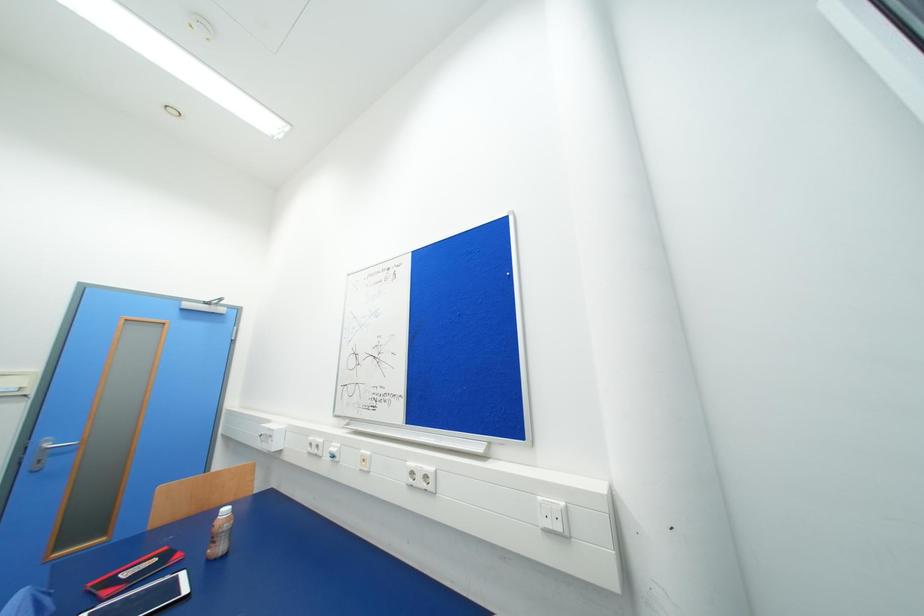
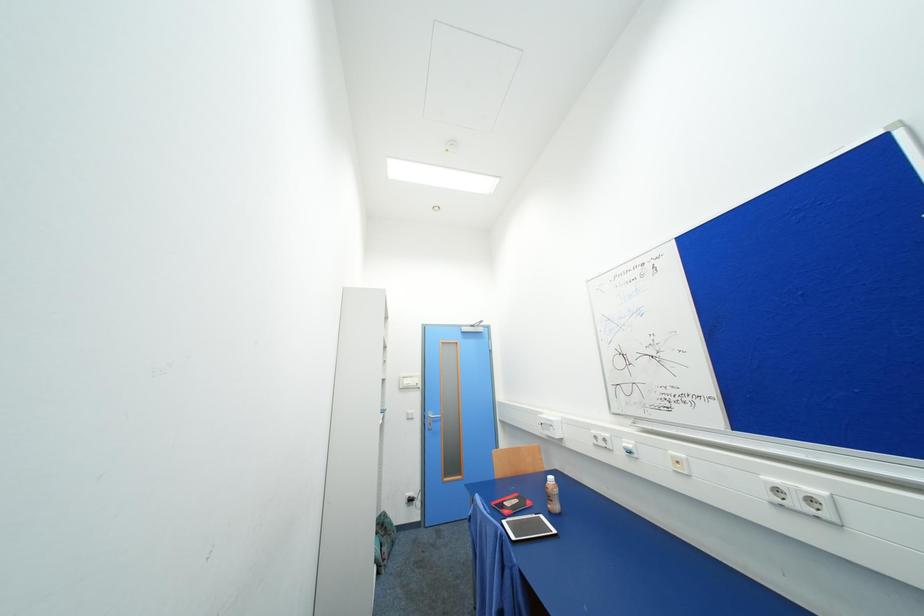
Question: The camera is either moving clockwise (left) or counter-clockwise (right) around the object. The first image is from the beginning of the video and the second image is from the end. Is the camera moving left or right when shooting the video?

Choices:
 (A) Left
 (B) Right

Answer: (B)